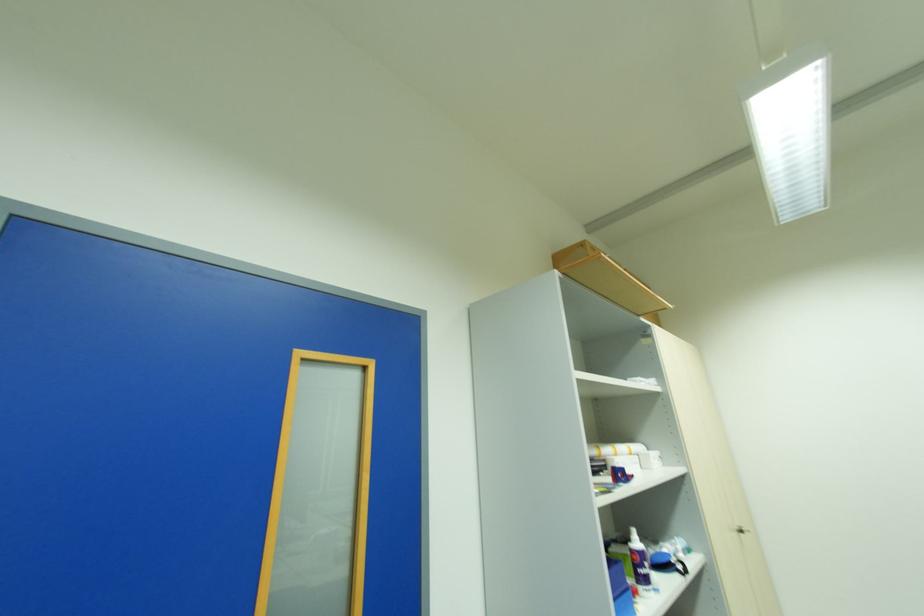
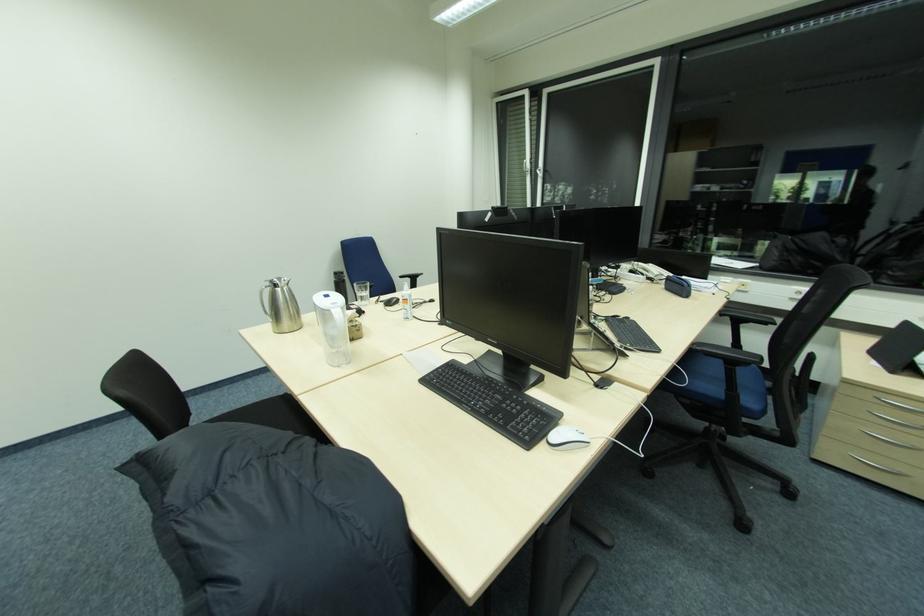
First-person continuous shooting, in which direction is the camera rotating?

The camera's rotation is toward right-down.